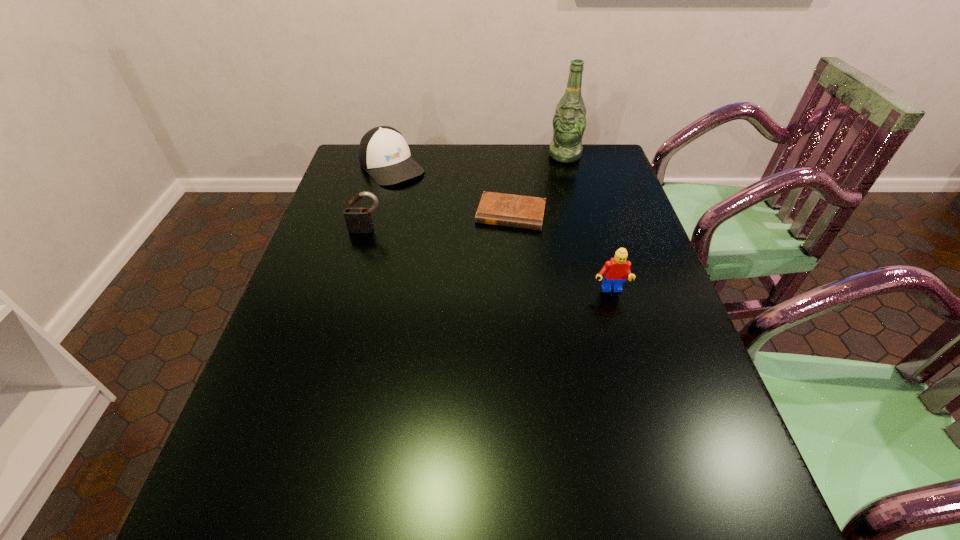
Locate an element on the screen. free space at the far right corner is located at coordinates (584, 154).

You are a GUI agent. You are given a task and a screenshot of the screen. Output one action in this format:
    pyautogui.click(x=<x>, y=<y>)
    Task: Click on the vacant space in between the tallest object and the third object from right to left
    
    Given the screenshot: What is the action you would take?
    point(538,185)

This screenshot has width=960, height=540. Find the location of `free space between the cap and the nearest object`. free space between the cap and the nearest object is located at coordinates (501, 229).

The height and width of the screenshot is (540, 960). I want to click on empty space between the nearest object and the cap, so click(x=501, y=229).

Where is `blank region between the padlock and the third object from left to right`? The width and height of the screenshot is (960, 540). blank region between the padlock and the third object from left to right is located at coordinates (439, 221).

Locate an element on the screen. This screenshot has height=540, width=960. free space that is in between the diary and the padlock is located at coordinates (439, 221).

This screenshot has height=540, width=960. I want to click on unoccupied position between the shortest object and the beer bottle, so point(538,185).

This screenshot has width=960, height=540. I want to click on vacant point located between the cap and the tallest object, so click(x=478, y=161).

You are a GUI agent. You are given a task and a screenshot of the screen. Output one action in this format:
    pyautogui.click(x=<x>, y=<y>)
    Task: Click on the free space between the Lego and the cap
    
    Given the screenshot: What is the action you would take?
    click(501, 229)

The height and width of the screenshot is (540, 960). I want to click on vacant space in between the padlock and the cap, so click(379, 198).